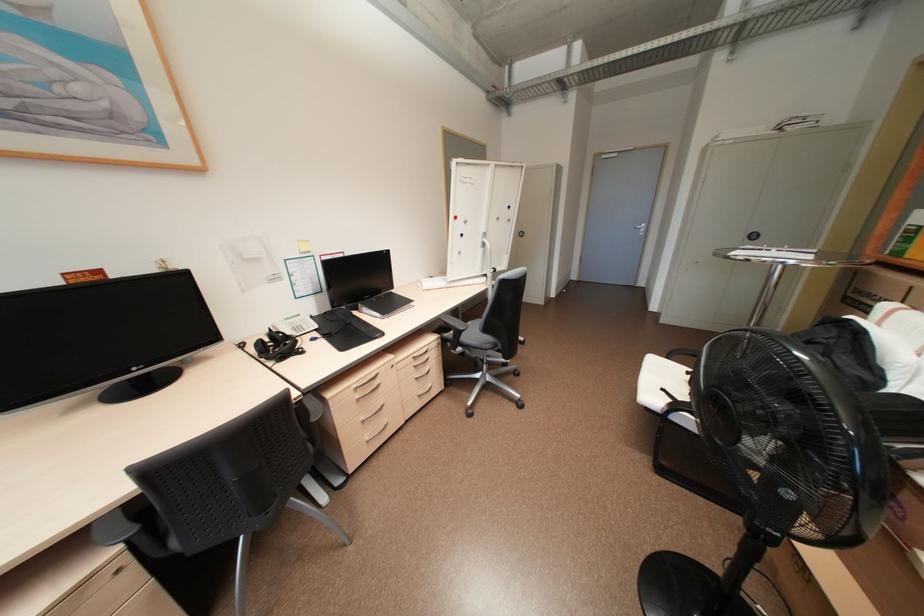
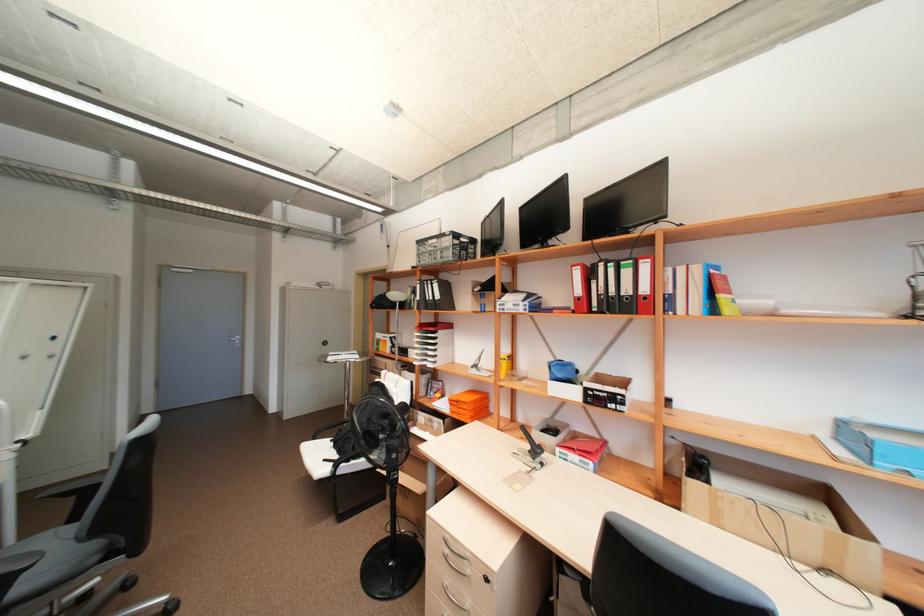
Where in the second image is the point corresponding to point 738,253 from the first image?

(334, 359)